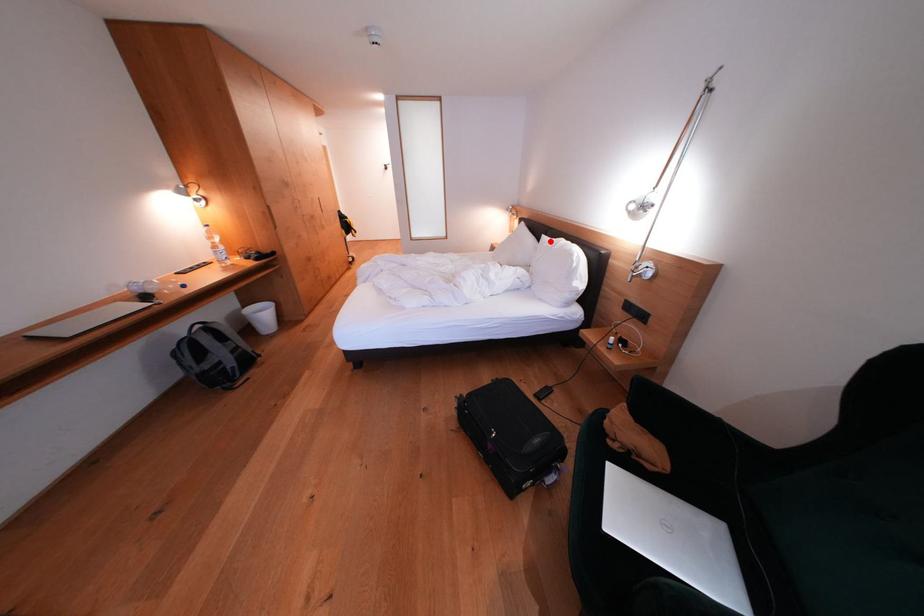
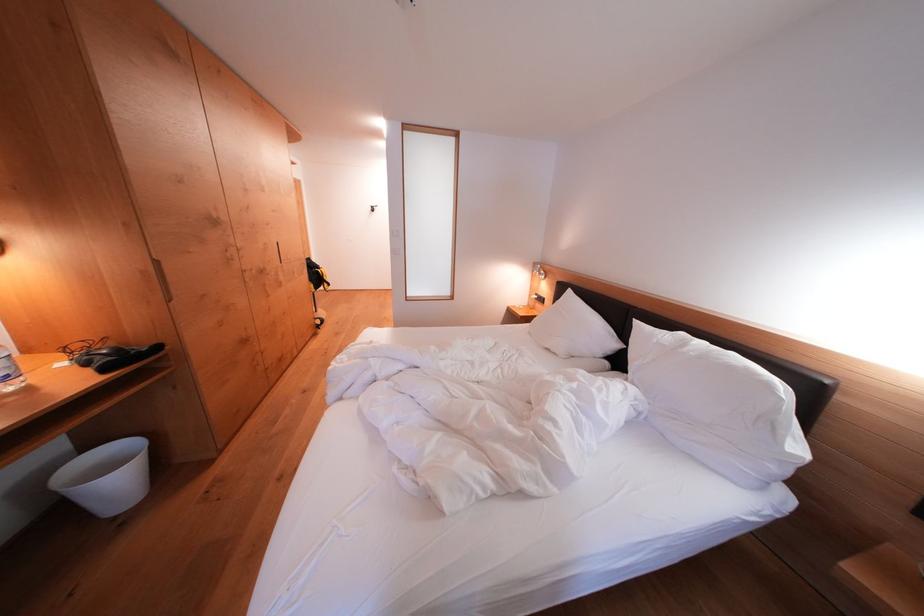
Question: I am providing you with two images of the same scene from different viewpoints. Given a red point in image1, look at the same physical point in image2. Is it:

Choices:
 (A) Closer to the viewpoint
 (B) Farther from the viewpoint

Answer: (A)